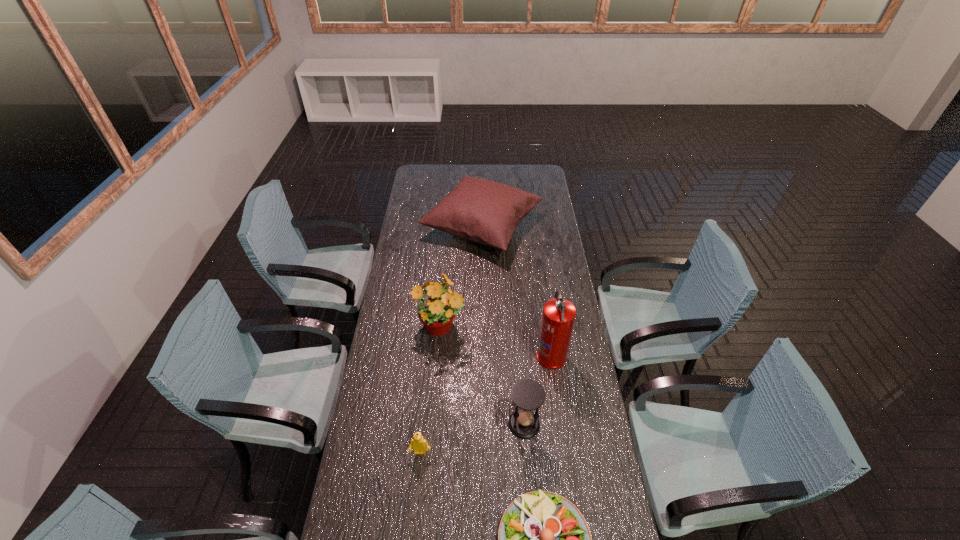
Find the location of a particular element. This screenshot has width=960, height=540. the tallest object is located at coordinates (558, 318).

Where is `flowerpot`? flowerpot is located at coordinates (436, 312).

Locate an element on the screen. The height and width of the screenshot is (540, 960). cushion is located at coordinates (483, 211).

Locate an element on the screen. This screenshot has width=960, height=540. the third nearest object is located at coordinates (528, 395).

Find the location of `the fifth farthest object`. the fifth farthest object is located at coordinates (420, 445).

This screenshot has height=540, width=960. Find the location of `the fifth tallest object`. the fifth tallest object is located at coordinates (420, 445).

You are a GUI agent. You are given a task and a screenshot of the screen. Output one action in this format:
    pyautogui.click(x=<x>, y=<y>)
    Task: Click on the vacant space situated on the instruction side of the tallest object
    
    Given the screenshot: What is the action you would take?
    pyautogui.click(x=459, y=355)

The height and width of the screenshot is (540, 960). I want to click on vacant position located on the instruction side of the tallest object, so click(x=454, y=355).

Locate an element on the screen. Image resolution: width=960 pixels, height=540 pixels. vacant space located on the instruction side of the tallest object is located at coordinates (516, 355).

Where is `free space located on the back of the flowerpot`? free space located on the back of the flowerpot is located at coordinates (444, 280).